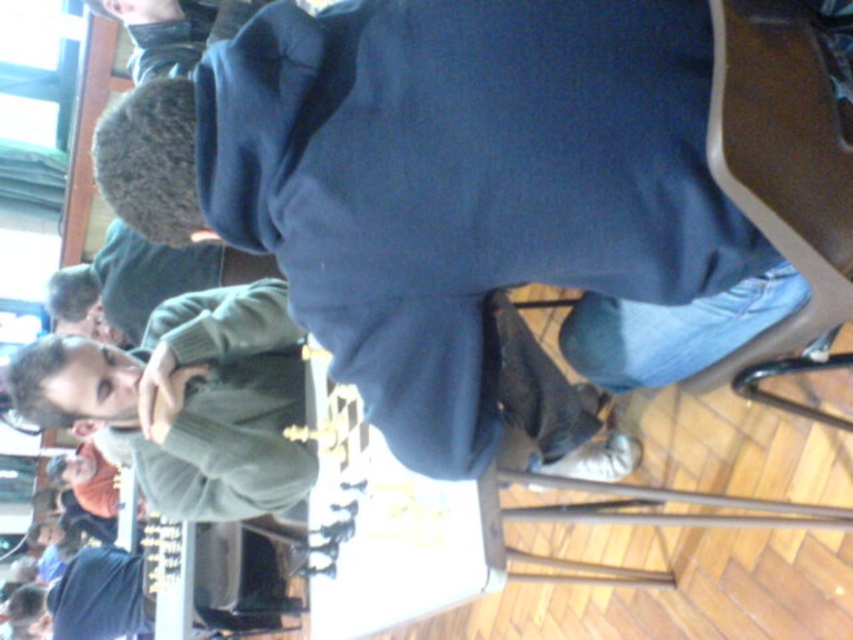
You are standing in the room and want to hand a chess piece to the person wearing the dark blue sweatshirt at center. Based on their position, which direction should you move to approach them?

The dark blue sweatshirt at center is located at point (x=460, y=193), so you should move towards the center of the room to reach them.

Based on the photo, you are standing in the rotated image and want to move towards the two points, point (x=248, y=211) and point (x=585, y=488). Which point should you head towards first to reach the closer one?

Point (x=248, y=211) is closer to the viewer than point (x=585, y=488), so you should head towards point (x=248, y=211) first.

You are a photographer trying to capture a candid shot of the dark blue sweatshirt at center and the brown fabric chair at lower right. Since the image is rotated, you need to adjust your camera angle. Based on the scene description, which object is positioned to the left of the other?

The dark blue sweatshirt at center is to the left of the brown fabric chair at lower right according to the description.